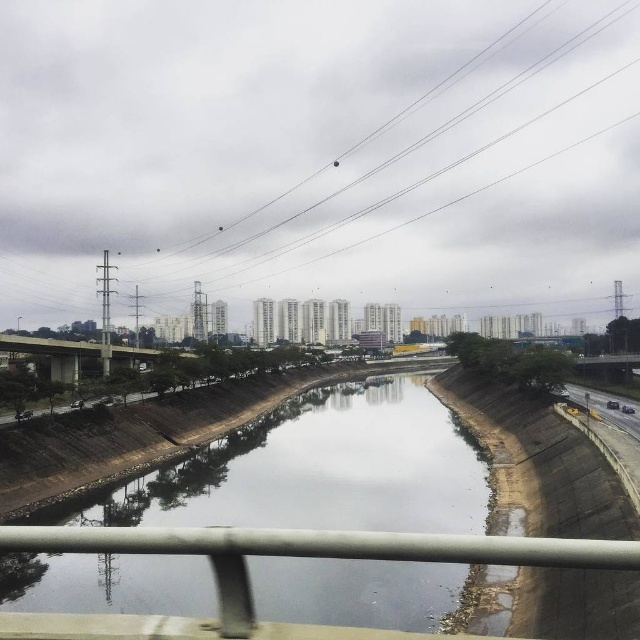
You are a drone operator who needs to fly a drone from the metallic wire at upper center to the concrete bridge at center. Considering the height difference between them, will the drone have to ascend or descend during this flight path?

The metallic wire at upper center is taller than the concrete bridge at center, so the drone will have to descend during the flight path.

You are a delivery driver needing to cross the clear concrete river at center to reach the other side. There is a concrete bridge at center nearby. Can you use the bridge to cross the river?

The clear concrete river at center and concrete bridge at center are 100.93 feet apart, so the bridge is too far to cross the river. You will need to find another way.

You are standing at point A with coordinates 0.6, 0.5 in the image. You want to walk to the clear concrete river at center. Which direction should you move to reach it?

You should move east to reach the clear concrete river at center because it is located at point (320, 468), which is to the east of your current position at (320, 384).